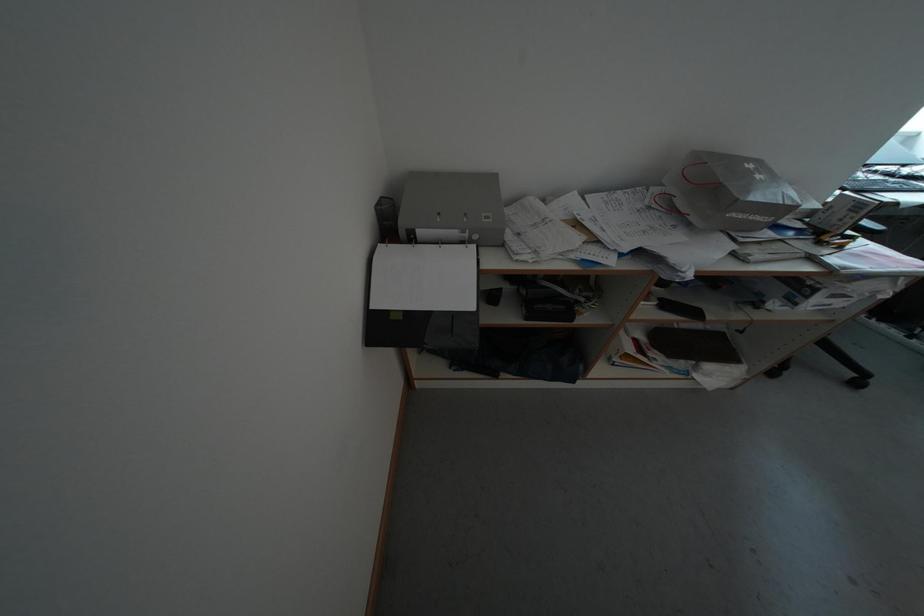
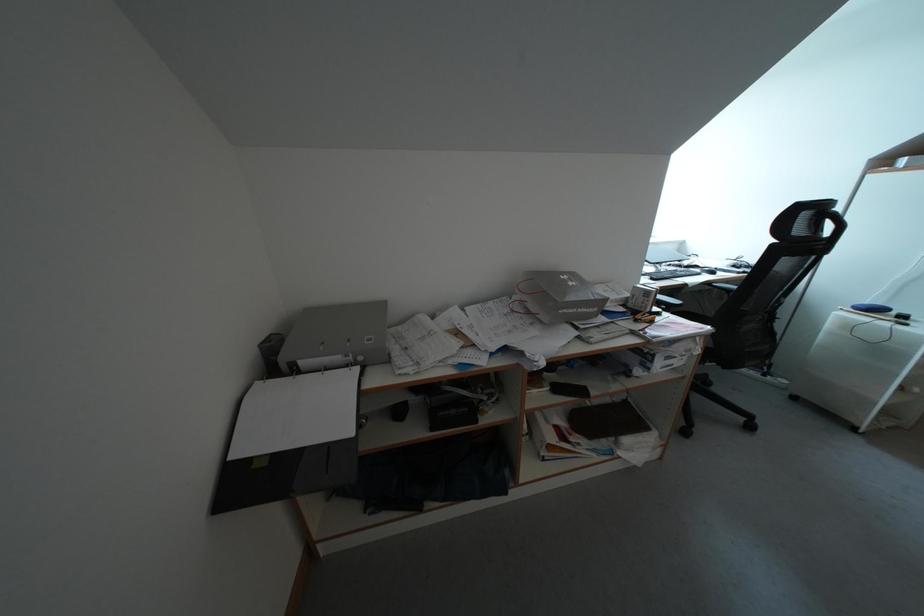
Question: The first image is from the beginning of the video and the second image is from the end. How did the camera likely rotate when shooting the video?

Choices:
 (A) Left
 (B) Right
 (C) Up
 (D) Down

Answer: (C)